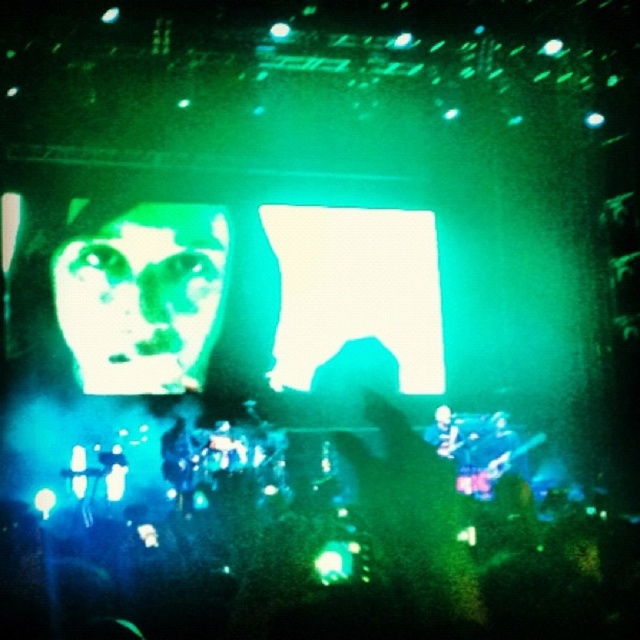
You are a photographer at the concert. You want to capture a photo that includes both the green matte face at center and the white matte face at center. Which one will appear closer to the camera in the photo?

The green matte face at center will appear closer to the camera because the white matte face at center is behind it.

Looking at this image, you are a photographer at the concert and want to capture a photo where both the green matte face at center and the white matte face at center are clearly visible. However, the green one is partially blocking the white one. Which face should you adjust your camera angle to focus on to ensure both are visible?

The green matte face at center is positioned over white matte face at center, so adjusting the camera angle to focus slightly above the green matte face at center would allow both to be visible without one blocking the other.

You are a photographer at the concert and want to capture both the green matte face at center and the white matte face at center in a single shot. Which face should you focus on first to ensure both are in frame?

The green matte face at center is bigger than the white matte face at center, so focusing on the larger green matte face at center first will help ensure both are in frame.